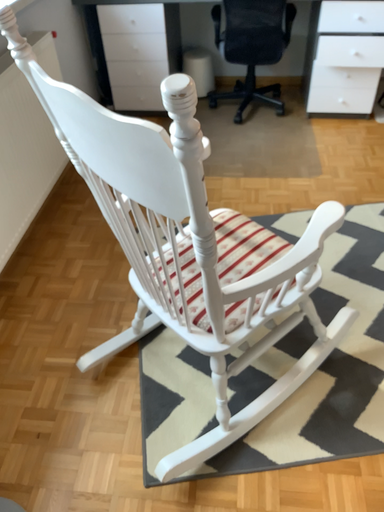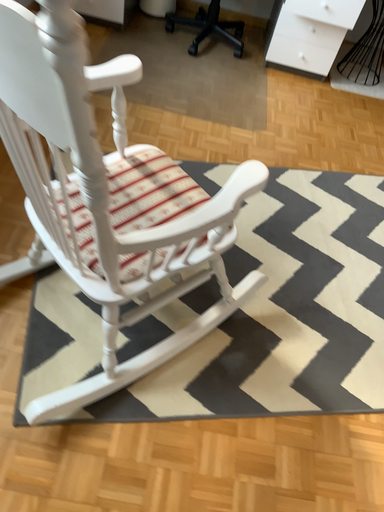
Question: Which way did the camera rotate in the video?

Choices:
 (A) rotated upward
 (B) rotated downward

Answer: (B)